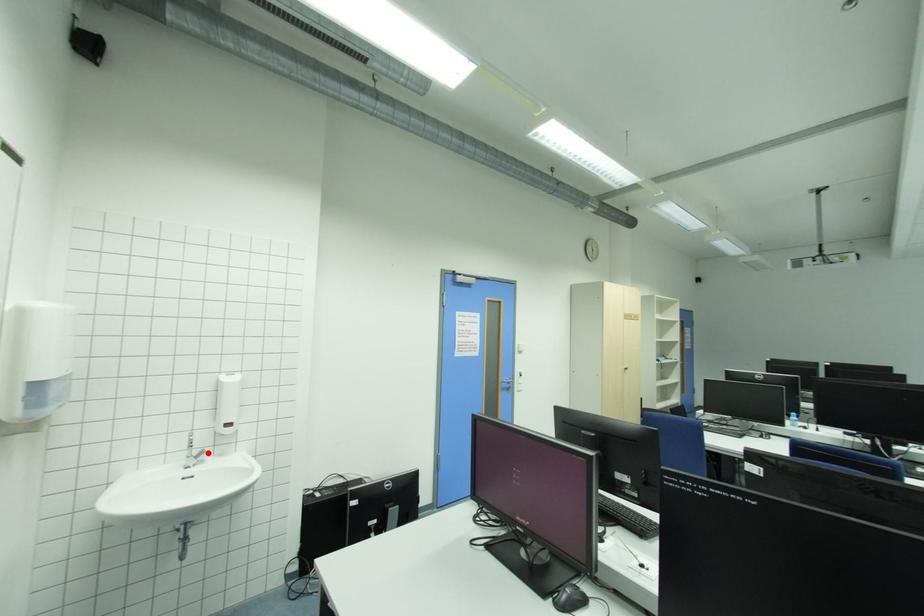
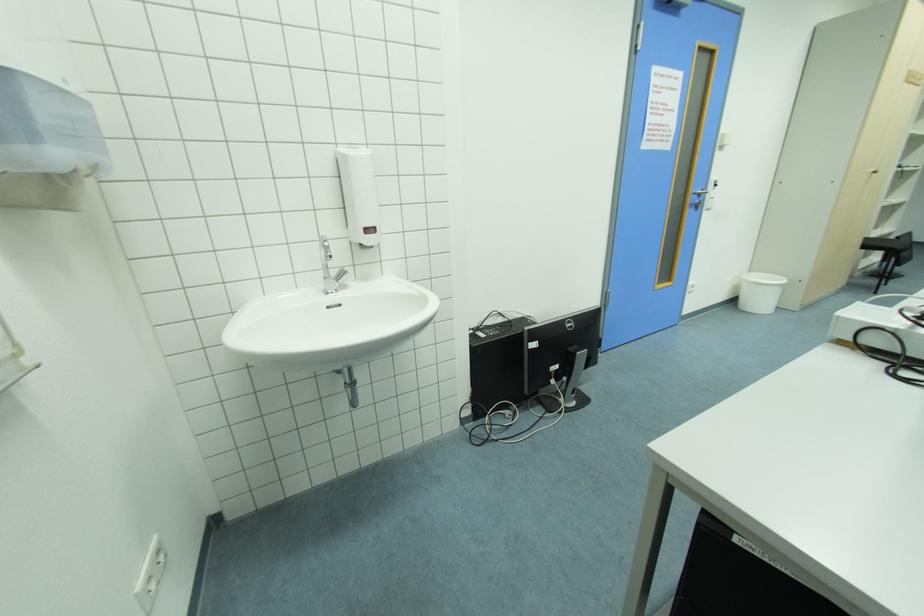
Locate, in the second image, the point that corresponds to the highlighted location in the first image.

(347, 274)